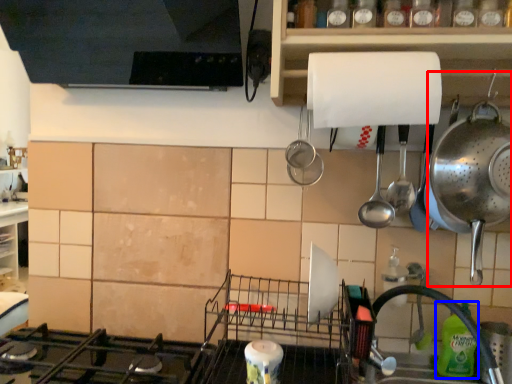
Question: Which object appears farthest to the camera in this image, appliance (highlighted by a red box) or bottle (highlighted by a blue box)?

Choices:
 (A) appliance
 (B) bottle

Answer: (B)